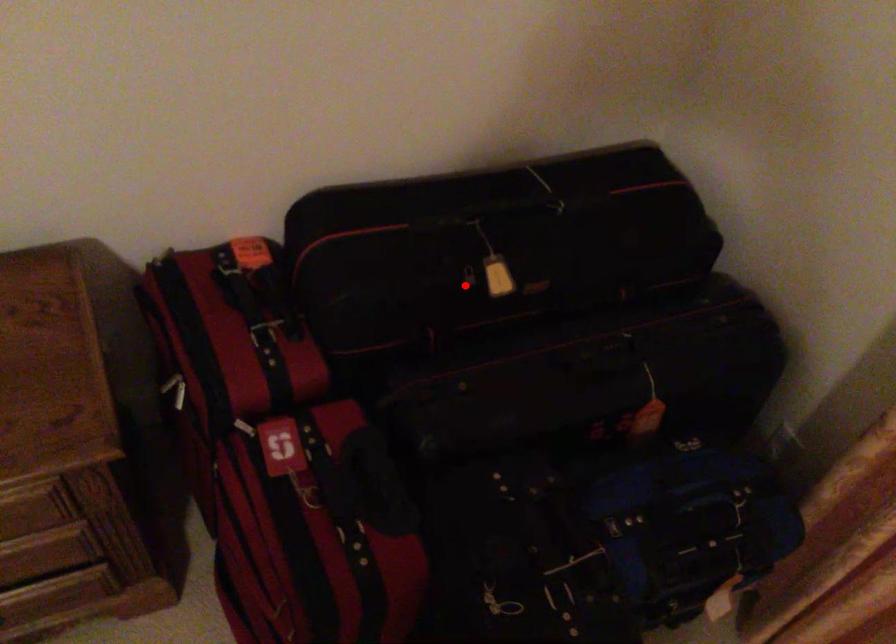
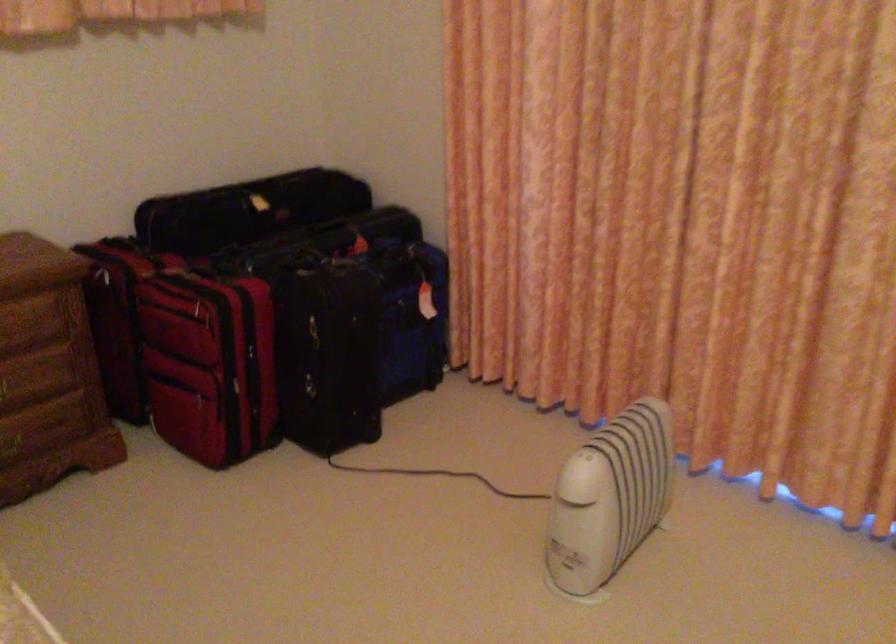
Question: I am providing you with two images of the same scene from different viewpoints. In image1, a red point is highlighted. Considering the same 3D point in image2, which of the following is correct?

Choices:
 (A) It is closer
 (B) It is farther

Answer: (B)